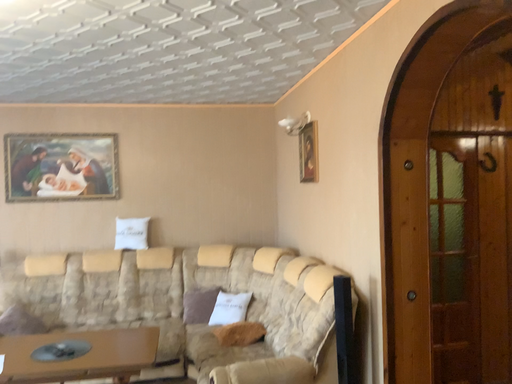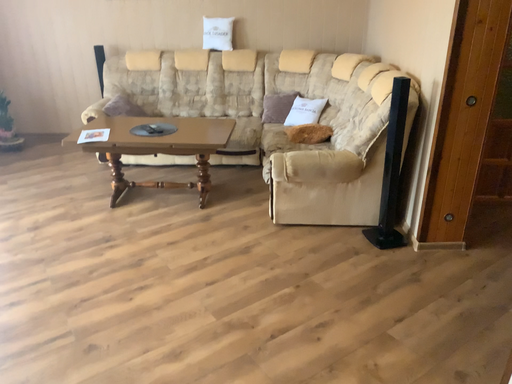
Question: Which way did the camera rotate in the video?

Choices:
 (A) rotated downward
 (B) rotated upward

Answer: (A)